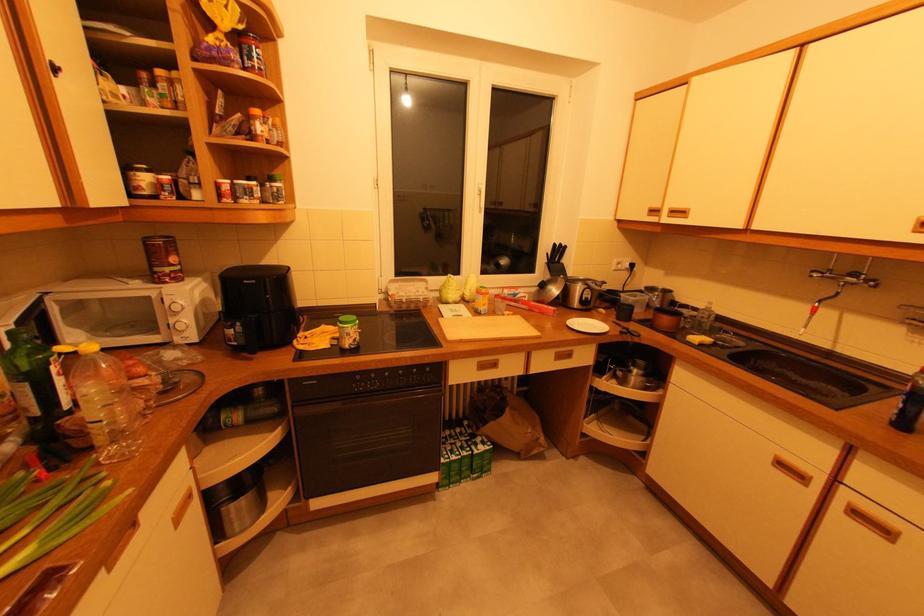
I want to click on recessed cabinet handle, so click(x=871, y=523).